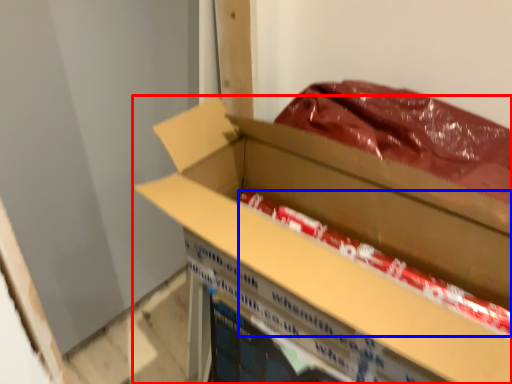
Question: Which point is further to the camera, box (highlighted by a red box) or wrapping paper (highlighted by a blue box)?

Choices:
 (A) box
 (B) wrapping paper

Answer: (B)